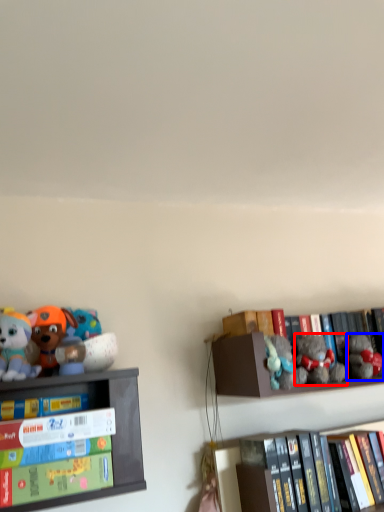
Question: Which object appears farthest to the camera in this image, toy (highlighted by a red box) or toy (highlighted by a blue box)?

Choices:
 (A) toy
 (B) toy

Answer: (B)